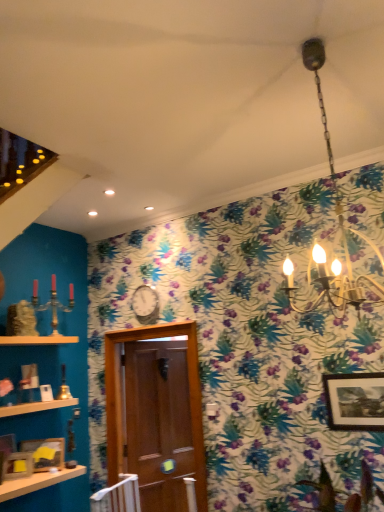
Question: Is the depth of wooden shelf at lower left, the 2th shelf in the bottom-to-top sequence, greater than that of metallic silver clock at center?

Choices:
 (A) no
 (B) yes

Answer: (A)

Question: Is wooden shelf at lower left, the 1th shelf positioned from the top, not within metallic silver clock at center?

Choices:
 (A) yes
 (B) no

Answer: (A)

Question: Is wooden shelf at lower left, the 1th shelf positioned from the top, smaller than metallic silver clock at center?

Choices:
 (A) yes
 (B) no

Answer: (B)

Question: Can you confirm if wooden shelf at lower left, the 2th shelf in the bottom-to-top sequence, is wider than metallic silver clock at center?

Choices:
 (A) yes
 (B) no

Answer: (A)

Question: From the image's perspective, is wooden shelf at lower left, the 2th shelf in the bottom-to-top sequence, beneath metallic silver clock at center?

Choices:
 (A) yes
 (B) no

Answer: (A)

Question: Is wooden photo frame at lower left, positioned as the 2th picture frame in left-to-right order, wider than brown wooden door at center?

Choices:
 (A) no
 (B) yes

Answer: (A)

Question: Can you confirm if wooden photo frame at lower left, positioned as the 2th picture frame in left-to-right order, is thinner than brown wooden door at center?

Choices:
 (A) no
 (B) yes

Answer: (B)

Question: Is wooden photo frame at lower left, positioned as the third picture frame in right-to-left order, closer to the viewer compared to brown wooden door at center?

Choices:
 (A) yes
 (B) no

Answer: (A)

Question: Is wooden photo frame at lower left, positioned as the third picture frame in right-to-left order, looking in the opposite direction of brown wooden door at center?

Choices:
 (A) no
 (B) yes

Answer: (A)

Question: Considering the relative sizes of wooden photo frame at lower left, positioned as the 2th picture frame in left-to-right order, and brown wooden door at center in the image provided, is wooden photo frame at lower left, positioned as the 2th picture frame in left-to-right order, shorter than brown wooden door at center?

Choices:
 (A) yes
 (B) no

Answer: (A)

Question: From a real-world perspective, is wooden photo frame at lower left, positioned as the 2th picture frame in left-to-right order, beneath brown wooden door at center?

Choices:
 (A) yes
 (B) no

Answer: (A)

Question: Is wooden picture frame at lower left, which ranks as the third picture frame in left-to-right order, inside wooden photo frame at lower left, positioned as the third picture frame in right-to-left order?

Choices:
 (A) no
 (B) yes

Answer: (A)